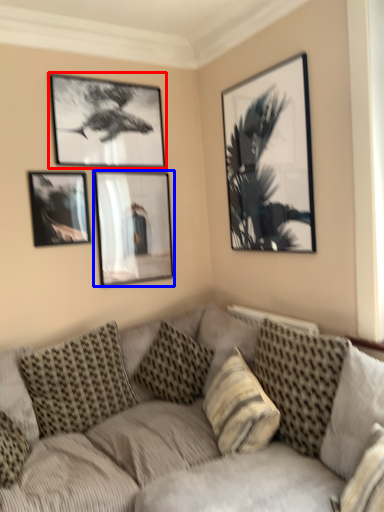
Question: Which object is further to the camera taking this photo, picture frame (highlighted by a red box) or picture frame (highlighted by a blue box)?

Choices:
 (A) picture frame
 (B) picture frame

Answer: (B)